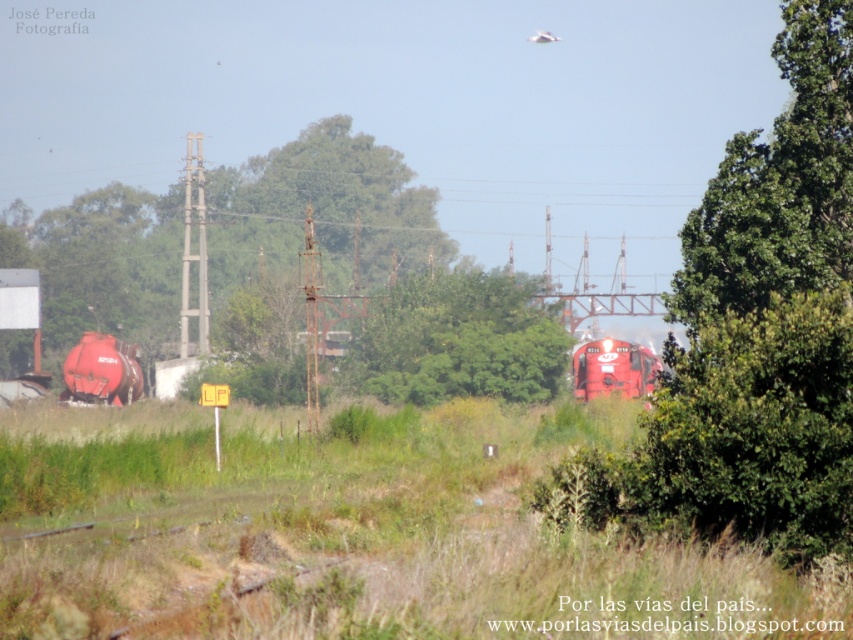
From the picture: You are a passenger on the shiny red train at center. Looking out the window, you see the green leafy tree at center. Which object appears taller from your perspective?

The green leafy tree at center appears taller than the shiny red train at center because the description states that the green leafy tree at center is much taller as shiny red train at center.